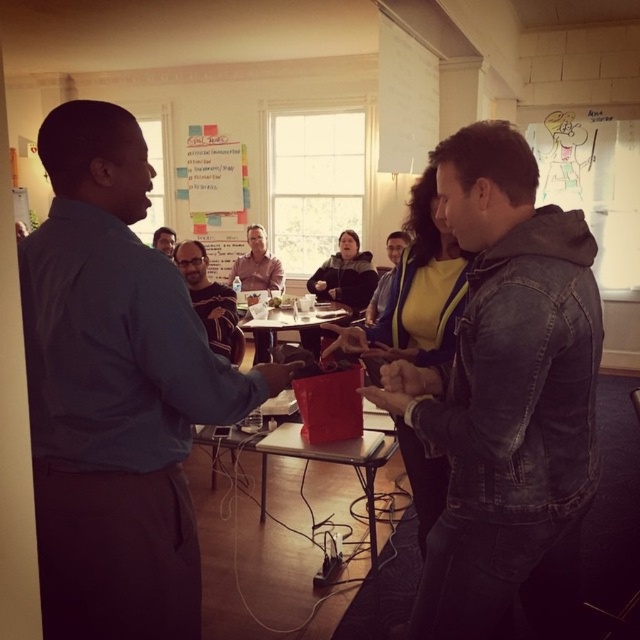
You are standing at the center of the room and want to hand a document to the person wearing the denim jacket at lower right. Based on the coordinates provided, in which direction should you move to reach them?

The denim jacket at lower right is located at coordinates point (506, 400), which is to the lower right of the room. To reach them, you should move towards the lower right direction from the center of the room.

You are standing at the origin point of the coordinate system where the red bucket is located. The denim jacket at lower right is at point [506,400]. If you want to move towards the denim jacket at lower right, in which direction should you move?

To move towards the denim jacket at lower right located at point [506,400] from the origin where the red bucket is, you should move in the direction of increasing x and y coordinates.